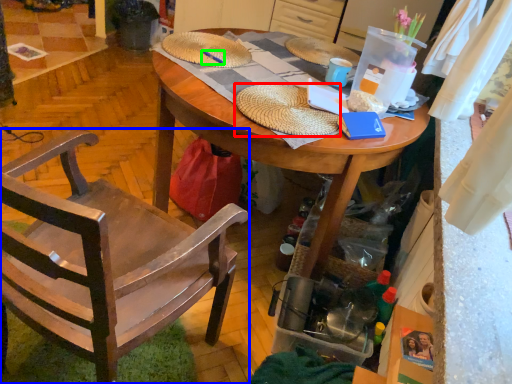
Question: Estimate the real-world distances between objects in this image. Which object is closer to hat (highlighted by a red box), chair (highlighted by a blue box) or pen (highlighted by a green box)?

Choices:
 (A) chair
 (B) pen

Answer: (B)